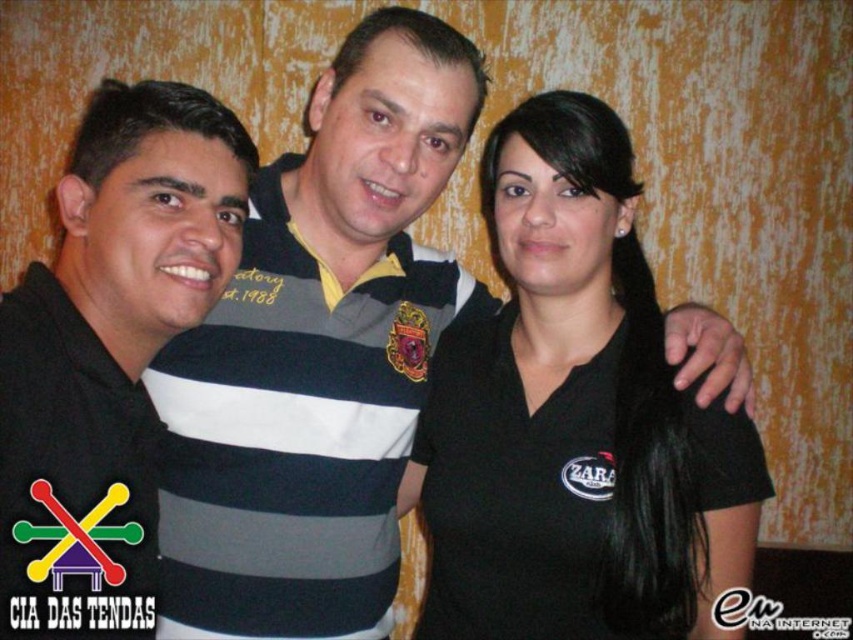
Question: Can you confirm if black matte shirt at center is positioned to the left of black striped polo shirt at center?

Choices:
 (A) yes
 (B) no

Answer: (B)

Question: Which object appears farthest from the camera in this image?

Choices:
 (A) black matte shirt at center
 (B) black striped polo shirt at center
 (C) striped cotton polo shirt at center

Answer: (C)

Question: Is striped cotton polo shirt at center to the right of black striped polo shirt at center from the viewer's perspective?

Choices:
 (A) yes
 (B) no

Answer: (A)

Question: Among these objects, which one is farthest from the camera?

Choices:
 (A) black striped polo shirt at center
 (B) black matte shirt at center

Answer: (B)

Question: Is striped cotton polo shirt at center to the right of black striped polo shirt at center from the viewer's perspective?

Choices:
 (A) no
 (B) yes

Answer: (B)

Question: Considering the real-world distances, which object is farthest from the black matte shirt at center?

Choices:
 (A) striped cotton polo shirt at center
 (B) black striped polo shirt at center

Answer: (B)